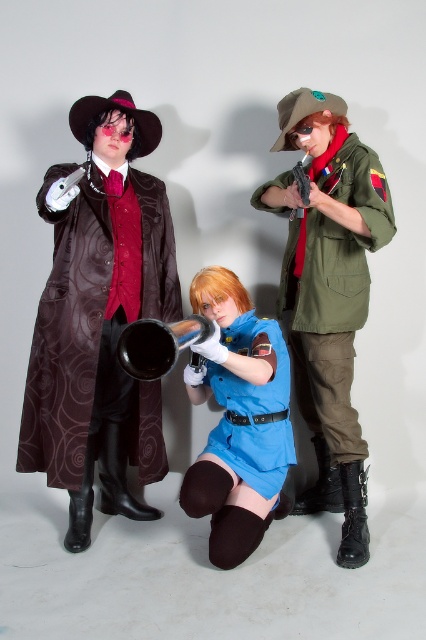
Looking at this image, between shiny brown coat at left and light blue fabric vest at center, which one has less height?

Standing shorter between the two is light blue fabric vest at center.

Does shiny brown coat at left have a greater height compared to light blue fabric vest at center?

Correct, shiny brown coat at left is much taller as light blue fabric vest at center.

Is point (69, 280) behind point (221, 545)?

Yes, it is behind point (221, 545).

The image size is (426, 640). What are the coordinates of `shiny brown coat at left` in the screenshot? It's located at (66, 333).

Who is positioned more to the left, light blue fabric vest at center or black metallic trumpet at center?

black metallic trumpet at center

Is light blue fabric vest at center thinner than black metallic trumpet at center?

No.

In order to click on light blue fabric vest at center in this screenshot , I will do `click(238, 419)`.

In the scene shown: Measure the distance between shiny brown coat at left and camera.

They are 1.84 meters apart.

Who is more distant from viewer, (x=28, y=465) or (x=158, y=333)?

The point (x=28, y=465) is more distant.

This screenshot has width=426, height=640. What do you see at coordinates (66, 333) in the screenshot? I see `shiny brown coat at left` at bounding box center [66, 333].

This screenshot has width=426, height=640. I want to click on shiny brown coat at left, so click(66, 333).